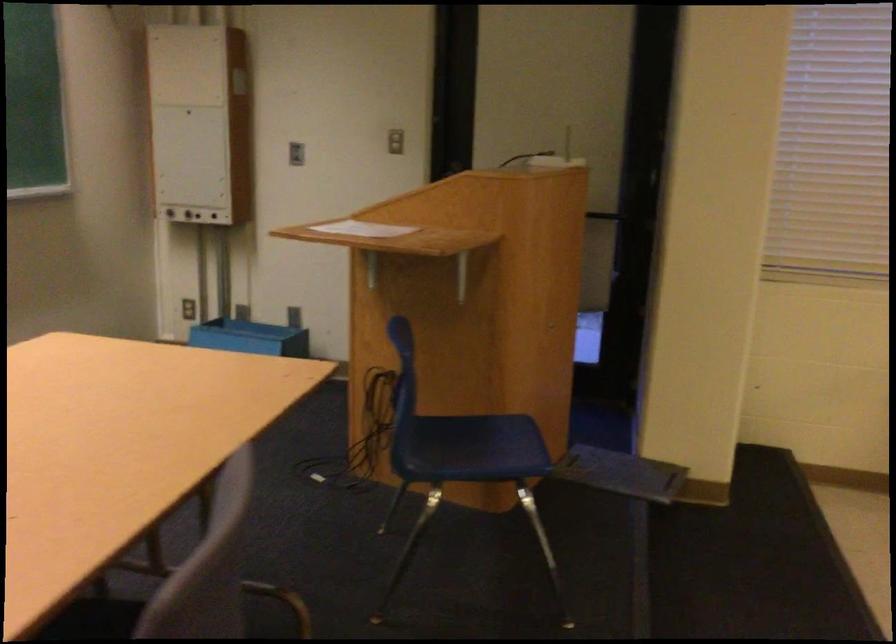
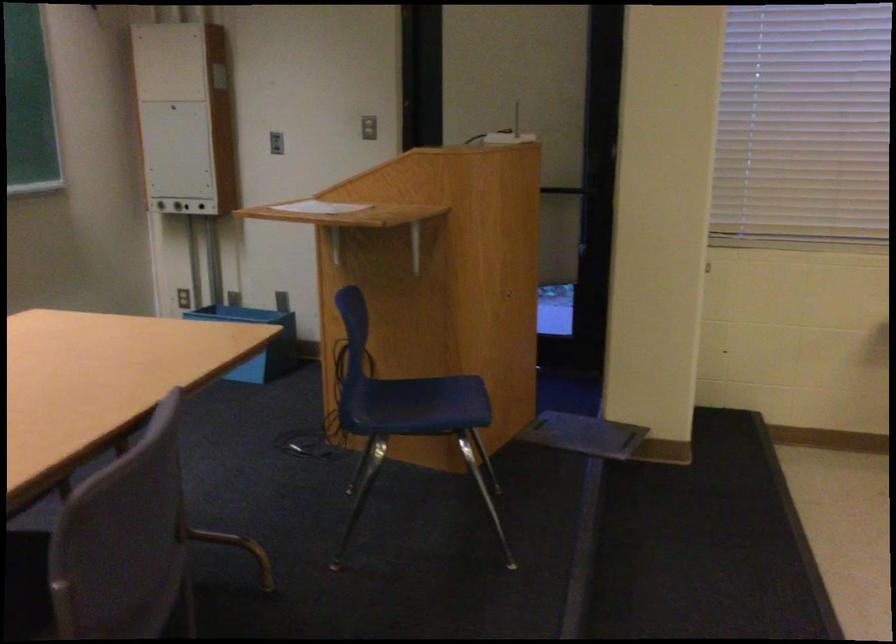
Locate, in the second image, the point that corresponds to point 359,227 in the first image.

(320, 207)